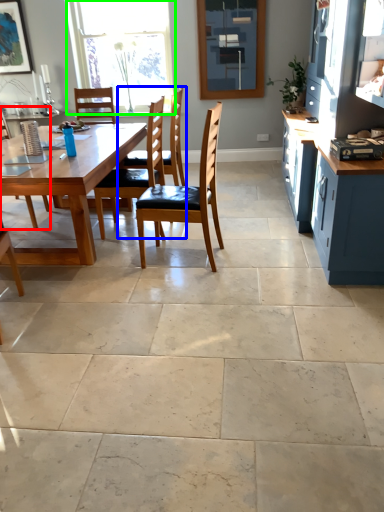
Question: Which object is the closest to the chair (highlighted by a red box)? Choose among these: chair (highlighted by a blue box) or window (highlighted by a green box).

Choices:
 (A) chair
 (B) window

Answer: (A)